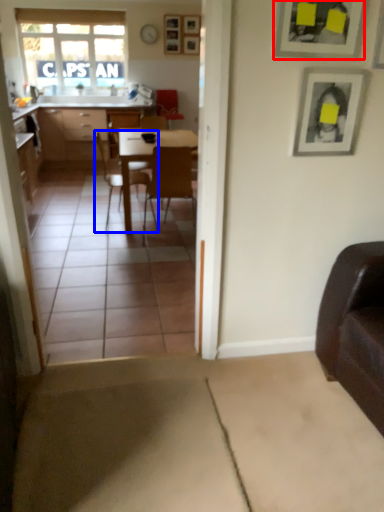
Question: Which object appears farthest to the camera in this image, picture frame (highlighted by a red box) or chair (highlighted by a blue box)?

Choices:
 (A) picture frame
 (B) chair

Answer: (B)